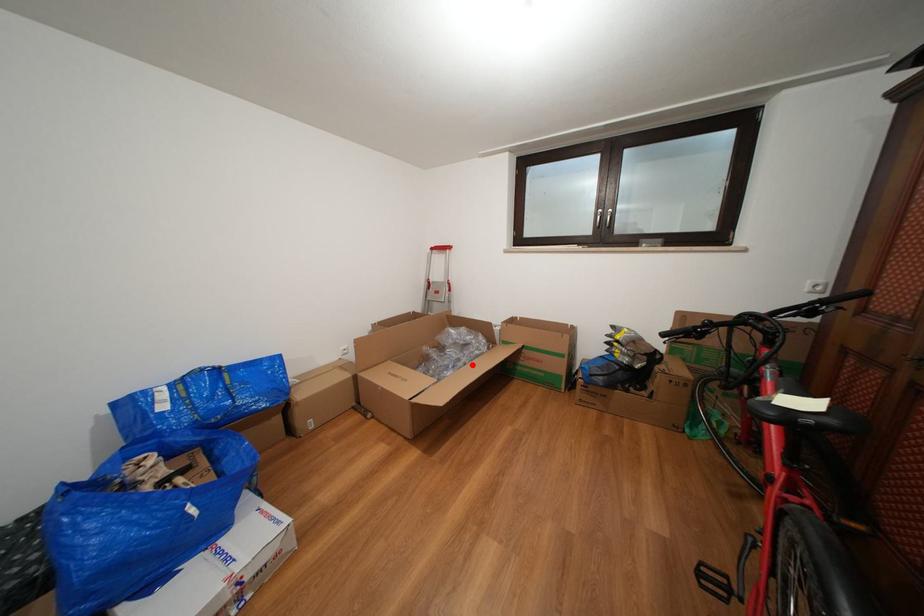
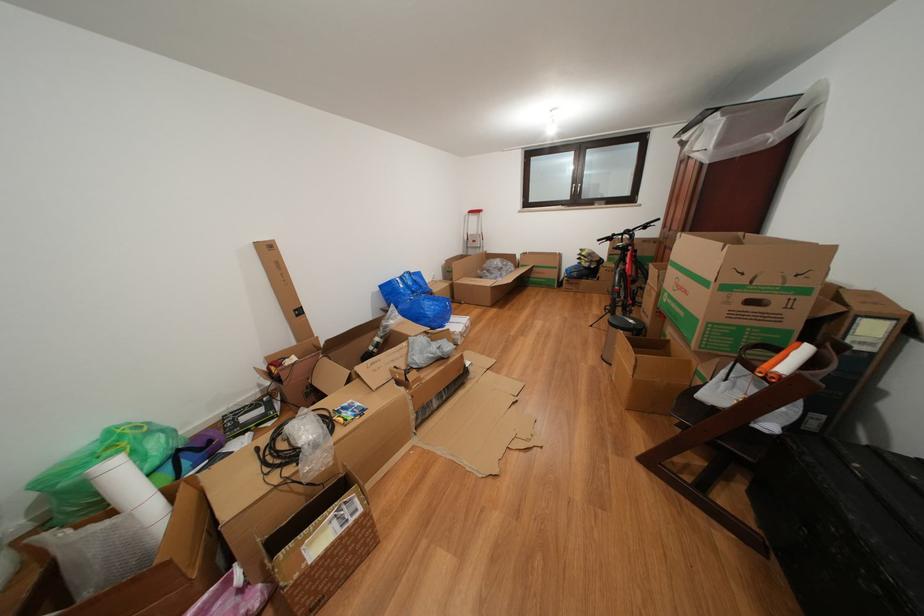
Question: I am providing you with two images of the same scene from different viewpoints. A red point is marked on the first image. Is the red point's position out of view in image 2?

Choices:
 (A) Yes
 (B) No

Answer: (B)